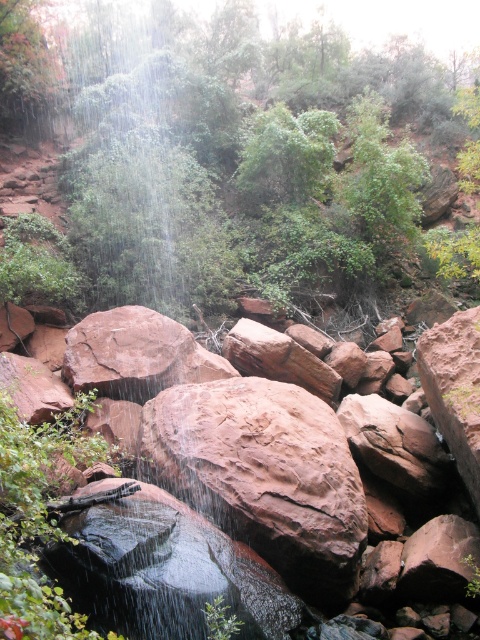
Who is shorter, rusty rock at center or green mossy rock at upper left?

Standing shorter between the two is rusty rock at center.

This screenshot has height=640, width=480. I want to click on rusty rock at center, so click(269, 509).

Is rusty rock at center closer to camera compared to reddish-brown rough rock at center?

That is False.

Does rusty rock at center have a lesser width compared to reddish-brown rough rock at center?

Indeed, rusty rock at center has a lesser width compared to reddish-brown rough rock at center.

Locate an element on the screen. This screenshot has height=640, width=480. rusty rock at center is located at coordinates (269, 509).

Who is shorter, reddish-brown rough rock at center or green mossy rock at upper left?

With less height is reddish-brown rough rock at center.

Is reddish-brown rough rock at center in front of green mossy rock at upper left?

Yes.

Does point (203, 392) lie in front of point (98, 147)?

Yes.

This screenshot has width=480, height=640. Identify the location of reddish-brown rough rock at center. (264, 474).